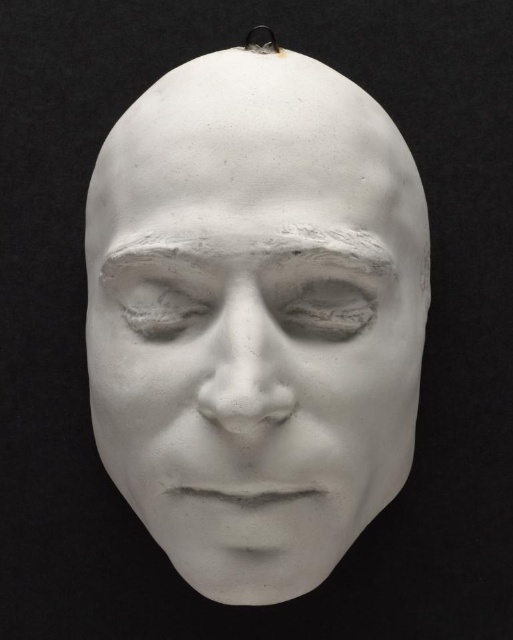
You are a painter standing at the point marked as point (303, 131). You want to paint a large mural on the wall behind the life mask. The wall is 3 meters wide. Can you fit the entire mask into your painting without cropping any part of it?

The distance between you and the life mask is 1.23 meters. Since the wall is 3 meters wide, you can easily fit the entire mask into your painting without cropping any part of it.

You are an artist trying to paint a portrait of the mask. You need to know the relative sizes of the white matte plaster forehead at upper center and the matte white eye at center. Which one is taller?

The white matte plaster forehead at upper center is much taller than the matte white eye at center.

You are an art restorer examining the image. You notice two white objects in the scene. Which object is closer to you, the white matte mask at center or the matte white eye at center?

The white matte mask at center is closer to you because it is in front of the matte white eye at center.